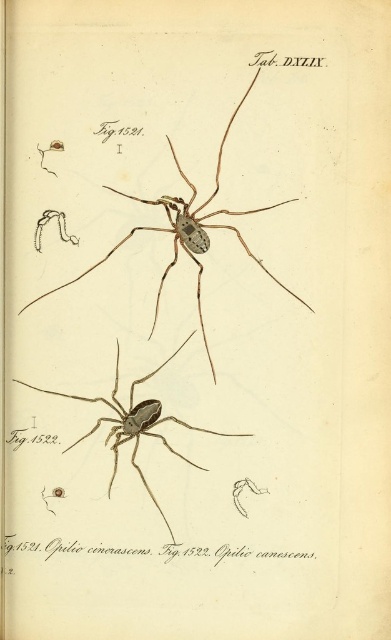
You are a photographer aiming to capture a closeup of the translucent brown spider at upper center in this scientific illustration. Given that your camera can focus on subjects within 1 meter, will you need to adjust your position to get a clear shot?

The translucent brown spider at upper center is 1.35 meters away from the camera, which is beyond the 1 meter focusing range. You will need to move closer or use a different lens to achieve a clear focus.

You are examining a page from a scientific book that has two spiders illustrated. The page has a translucent brown spider at upper center and a matte black spider at center. According to the illustration, which spider is positioned to the right of the other?

The translucent brown spider at upper center is to the right of the matte black spider at center.